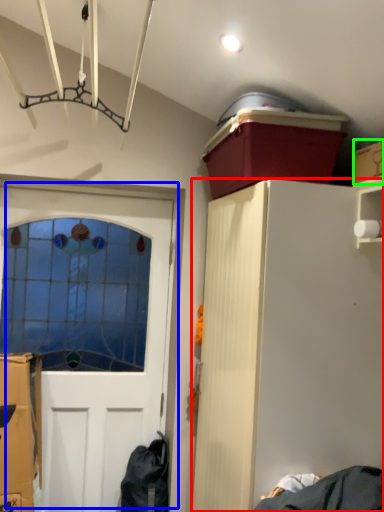
Question: Considering the real-world distances, which object is closest to cabinetry (highlighted by a red box)? door (highlighted by a blue box) or cardboard box (highlighted by a green box).

Choices:
 (A) door
 (B) cardboard box

Answer: (B)